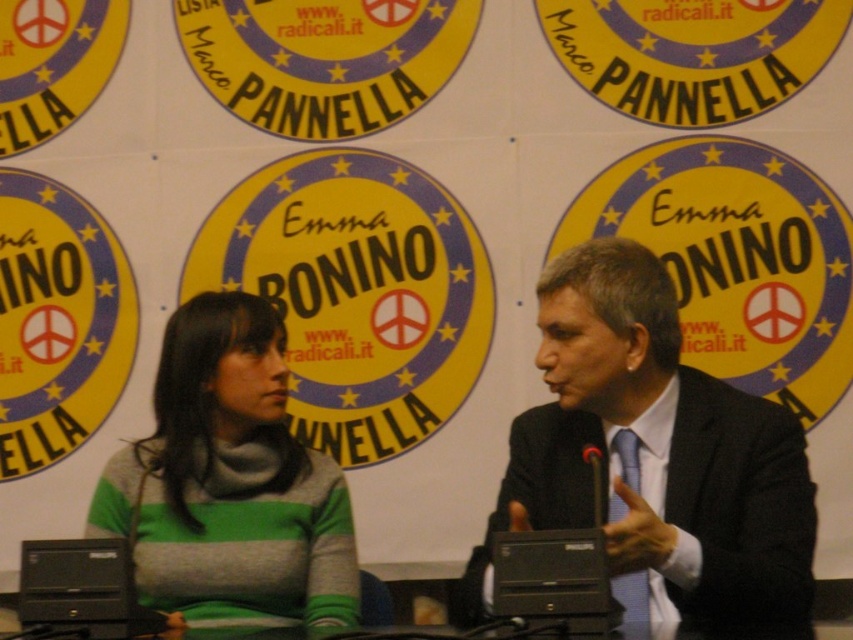
You are standing at the point where the person on the right is sitting. You want to move to the point marked at point (747, 458). How far will you have to walk?

The distance between the point where you are standing and the point marked at point (747, 458) is 7.97 feet, so you will have to walk 7.97 feet.

You are standing in front of the image. Where exactly is the dark suit at center located in terms of coordinates?

The dark suit at center is located at point (656, 458).

You are a photographer trying to capture a closeup of the dark suit at center without including the green knitted sweater at center in the frame. Given their positions, is this possible?

The dark suit at center is in front of the green knitted sweater at center, so it is possible to take a closeup of the dark suit at center without including the green knitted sweater at center in the frame by focusing solely on the front subject.